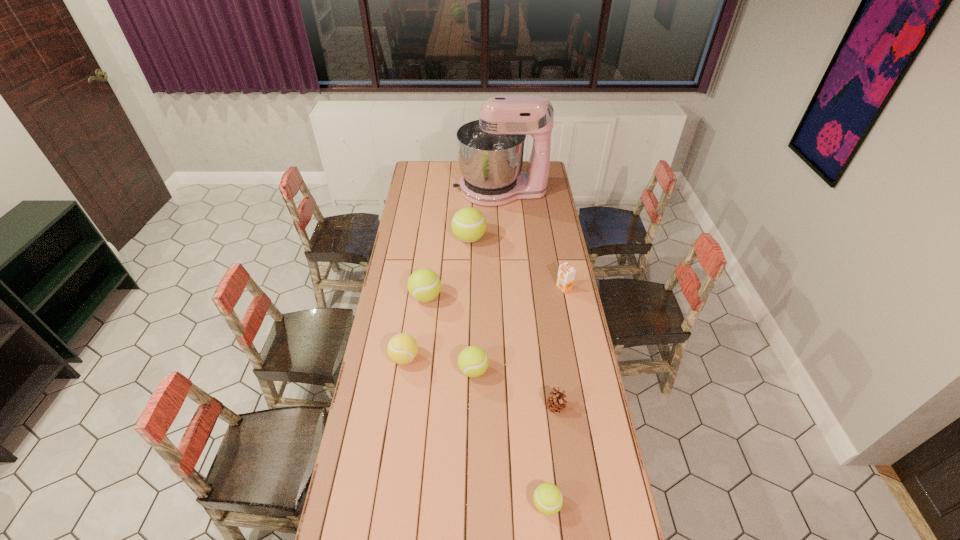
What are the coordinates of `vacant point located between the orange orange juice and the seventh shortest object` in the screenshot? It's located at (516, 263).

You are a GUI agent. You are given a task and a screenshot of the screen. Output one action in this format:
    pyautogui.click(x=<x>, y=<y>)
    Task: Click on the unoccupied area between the orange juice and the yellow tennis ball
    The image size is (960, 540).
    Given the screenshot: What is the action you would take?
    pyautogui.click(x=484, y=323)

Locate an element on the screen. free space between the nearest tennis ball and the farthest tennis ball is located at coordinates (508, 372).

Find the location of a particular element. free space that is in between the shortest object and the farthest object is located at coordinates pos(523,347).

Find the location of a particular element. empty space between the biggest green tennis ball and the yellow tennis ball is located at coordinates (437, 298).

Image resolution: width=960 pixels, height=540 pixels. I want to click on blank region between the second nearest object and the mixer, so click(x=528, y=299).

The width and height of the screenshot is (960, 540). Identify the location of free area in between the farthest green tennis ball and the second tallest tennis ball. (447, 268).

Find the location of a particular element. The height and width of the screenshot is (540, 960). blank region between the shortest tennis ball and the tallest object is located at coordinates (523, 347).

Identify the location of the sixth closest object to the farthest object. This screenshot has width=960, height=540. (555, 402).

The width and height of the screenshot is (960, 540). Identify the location of object that ranks as the third closest to the tallest object. (424, 285).